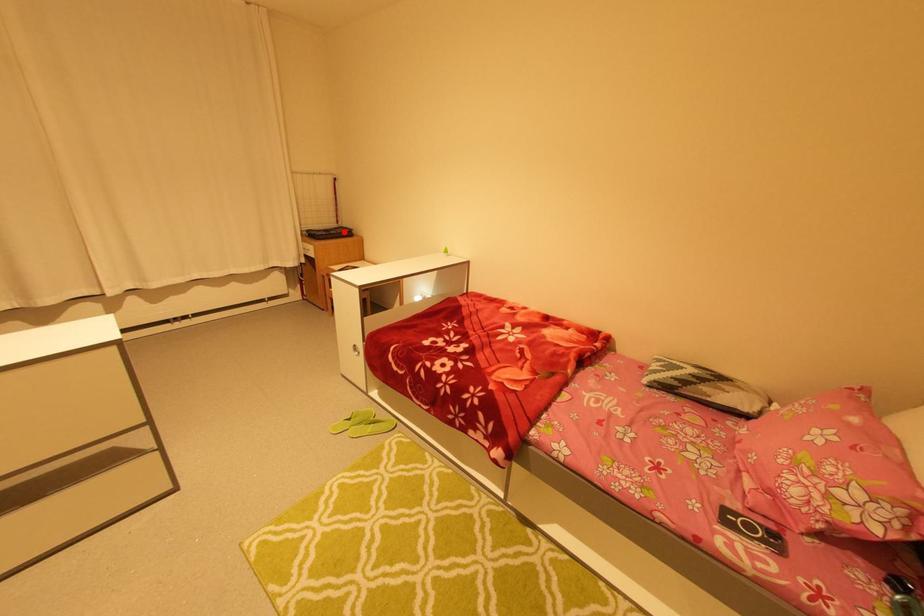
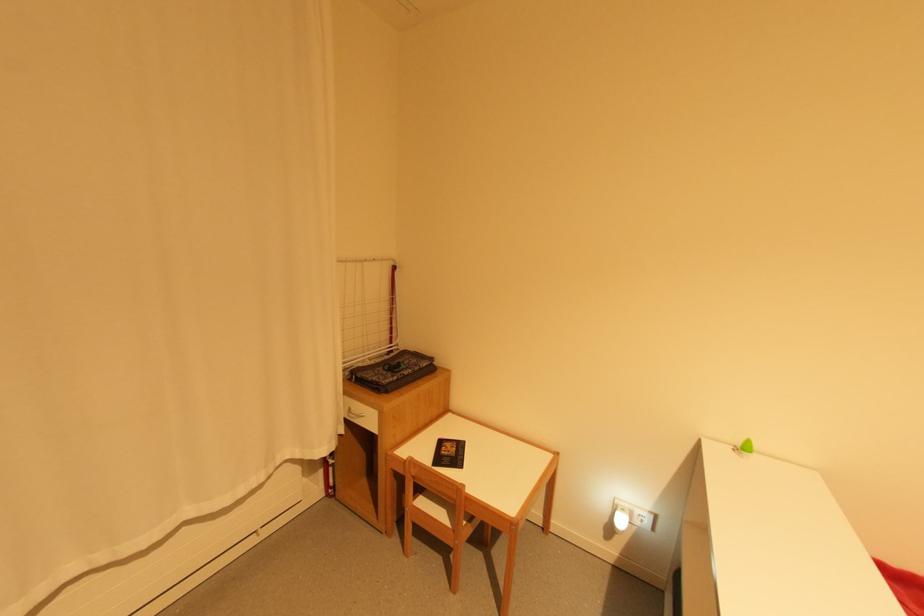
Question: I am providing you with two images of the same scene from different viewpoints. A red point is shown in image1. For the corresponding object point in image2, is it positioned nearer or farther from the camera?

Choices:
 (A) Nearer
 (B) Farther

Answer: (B)